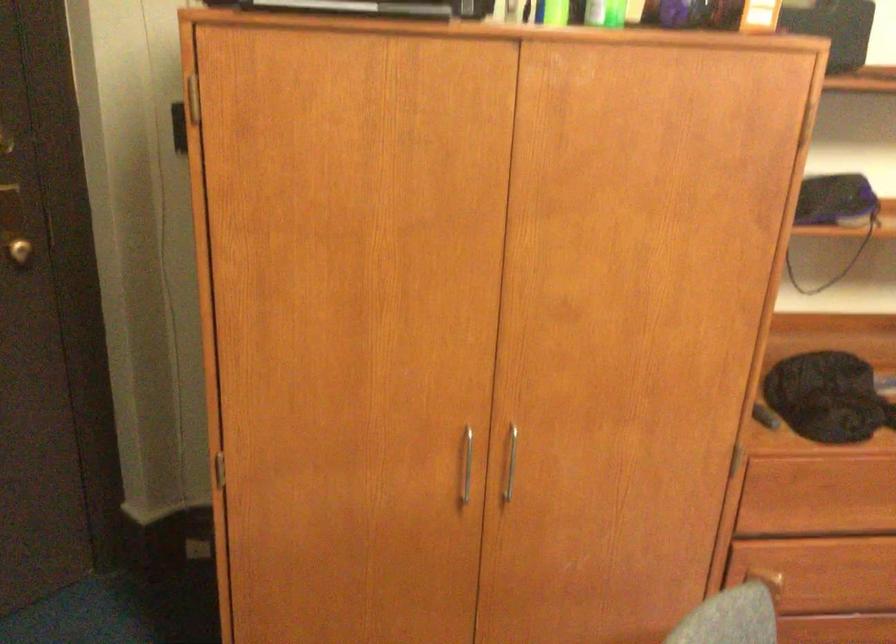
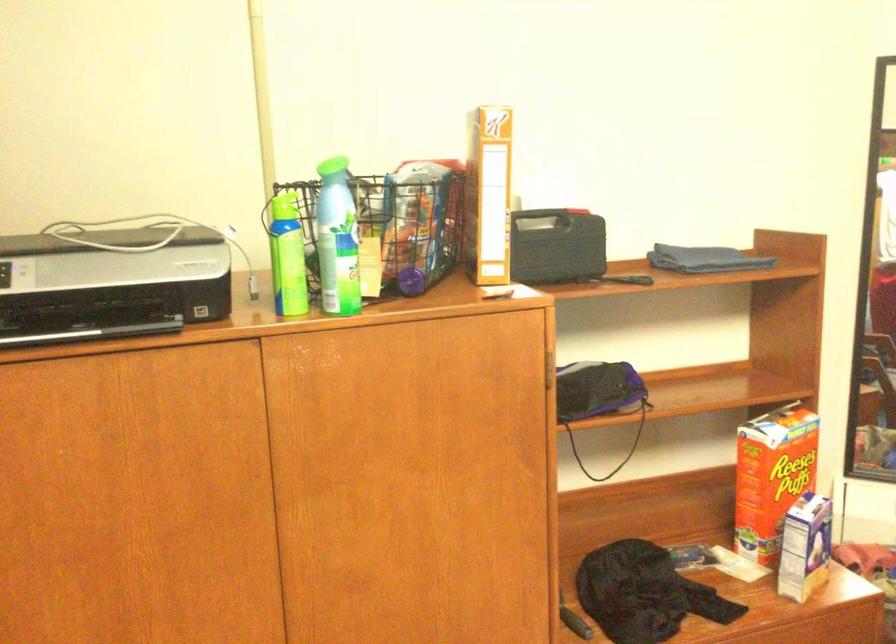
Question: What movement of the cameraman would produce the second image?

Choices:
 (A) Left
 (B) Right
 (C) Forward
 (D) Backward

Answer: (B)